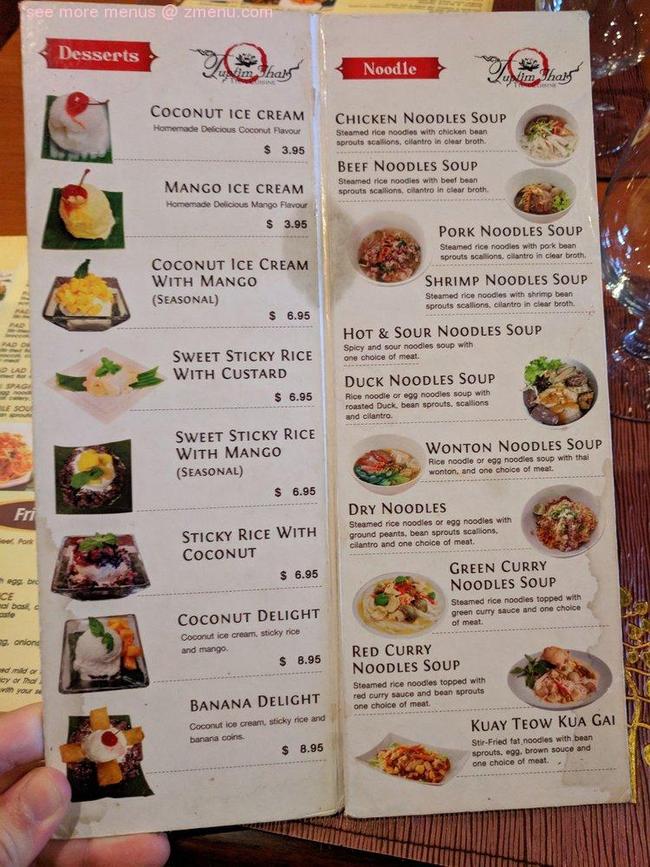
What are the coordinates of `wooden surface` in the screenshot? It's located at (562, 836).